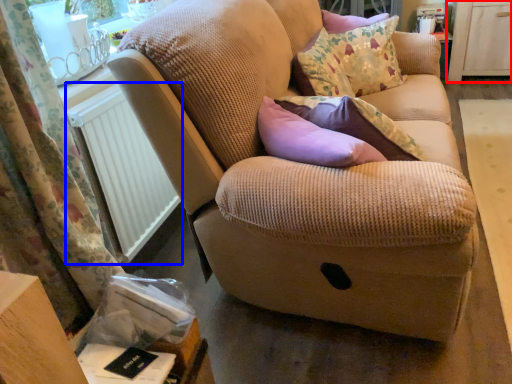
Question: Which object appears closest to the camera in this image, dresser (highlighted by a red box) or radiator (highlighted by a blue box)?

Choices:
 (A) dresser
 (B) radiator

Answer: (B)